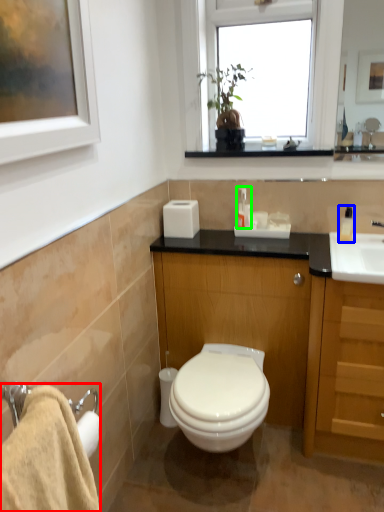
Question: Which object is the closest to the bath towel (highlighted by a red box)? Choose among these: soap dispenser (highlighted by a blue box) or toiletry (highlighted by a green box).

Choices:
 (A) soap dispenser
 (B) toiletry

Answer: (B)